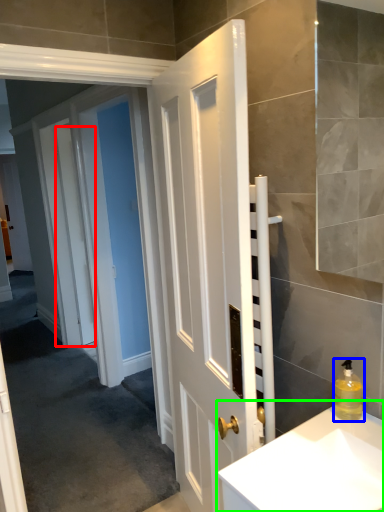
Question: Estimate the real-world distances between objects in this image. Which object is closer to door (highlighted by a red box), soap dispenser (highlighted by a blue box) or sink (highlighted by a green box)?

Choices:
 (A) soap dispenser
 (B) sink

Answer: (B)